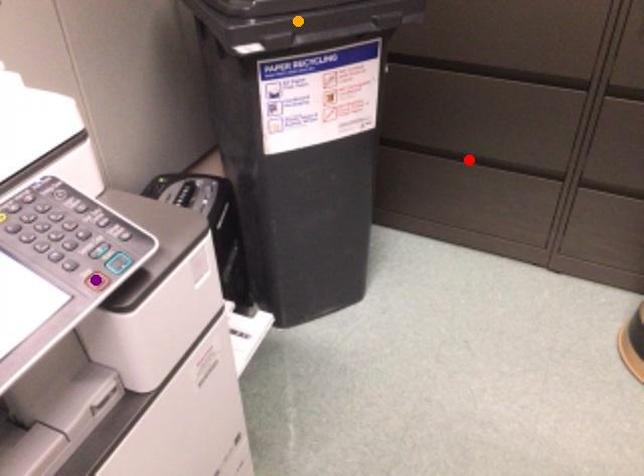
Order these from nearest to farthest:
- red point
- purple point
- orange point

purple point
orange point
red point